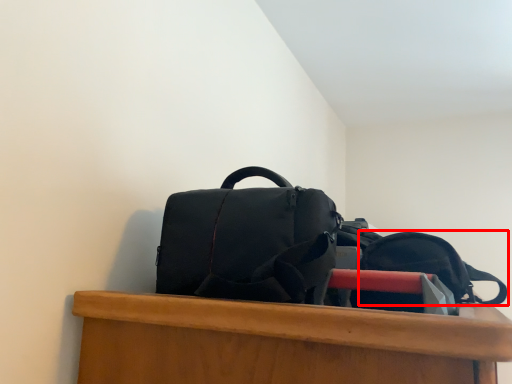
Question: From the image, what is the correct spatial relationship of backpack (annotated by the red box) in relation to backpack?

Choices:
 (A) left
 (B) right

Answer: (B)